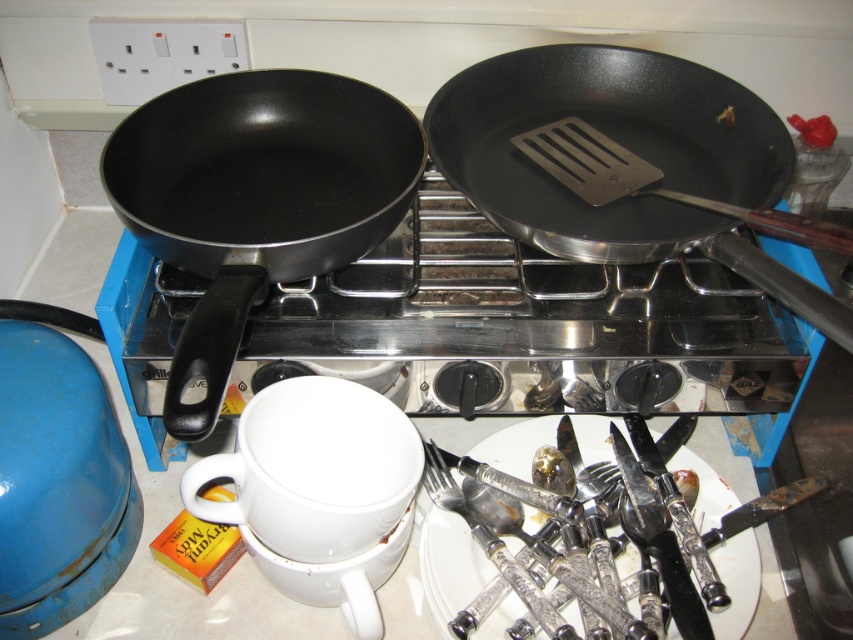
From the picture: You are a chef preparing a meal and need to access both the matte black frying pan at left and the matte black frying pan at upper right. Which pan would you need to move first to reach the one behind it?

The matte black frying pan at left is located below the matte black frying pan at upper right. To access the one behind, you would need to move the matte black frying pan at left first.

You are a chef who needs to quickly grab a spatula from the pan that has one. Which pan should you reach for, the matte black frying pan at left or the matte black frying pan at upper right?

The matte black frying pan at upper right contains a metal spatula, so you should reach for the matte black frying pan at upper right to grab the spatula.